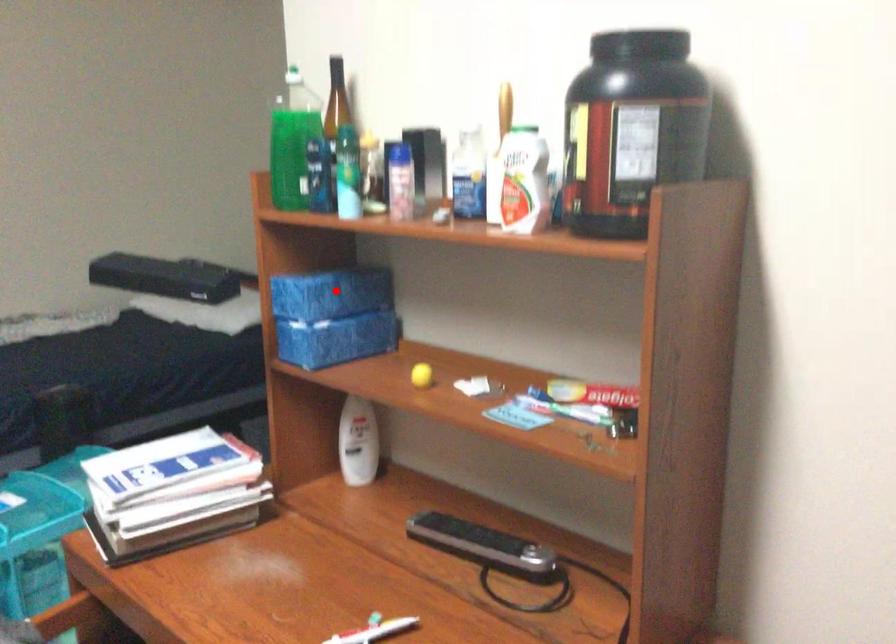
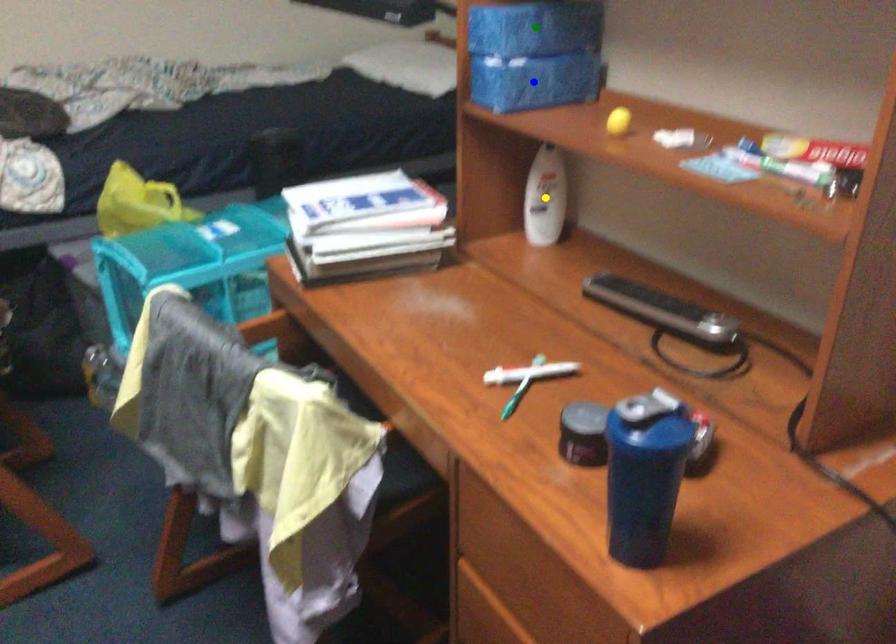
Question: I am providing you with two images of the same scene from different viewpoints. A red point is marked on the first image. You are given multiple points on the second image. Which point in image 2 represents the same 3d spot as the red point in image 1?

Choices:
 (A) blue point
 (B) yellow point
 (C) green point

Answer: (C)